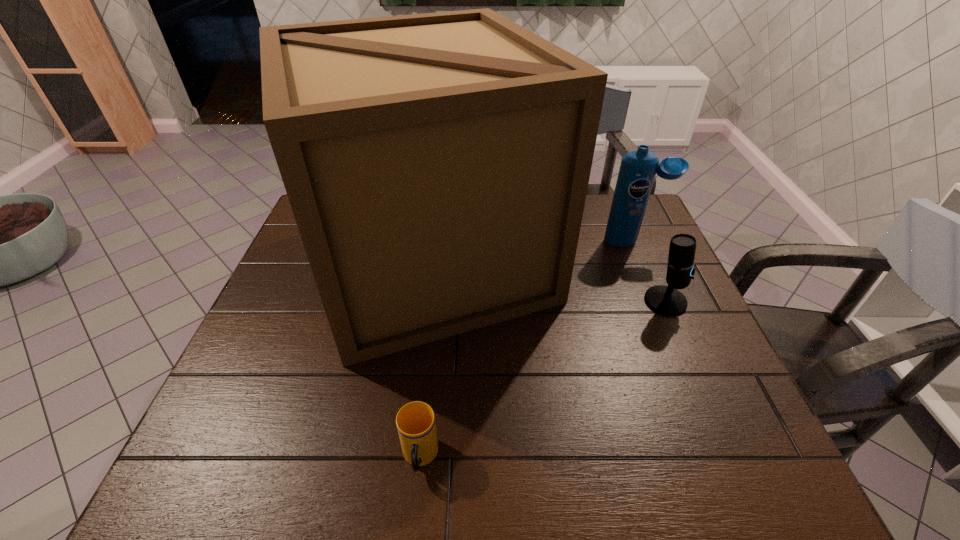
Find the location of `empty space that is in between the shortest object and the second tallest object`. empty space that is in between the shortest object and the second tallest object is located at coordinates (526, 349).

Locate an element on the screen. The image size is (960, 540). vacant space in between the cup and the second tallest object is located at coordinates (526, 349).

Locate an element on the screen. The image size is (960, 540). empty space that is in between the nearest object and the shampoo is located at coordinates (526, 349).

The height and width of the screenshot is (540, 960). In order to click on free point between the box and the nearest object in this screenshot , I will do tap(425, 360).

Locate an element on the screen. The width and height of the screenshot is (960, 540). free space that is in between the microphone and the shortest object is located at coordinates (542, 379).

Where is `unoccupied position between the microphone and the shampoo`? This screenshot has width=960, height=540. unoccupied position between the microphone and the shampoo is located at coordinates (649, 271).

Identify the location of vacant space in between the third shortest object and the microphone. (649, 271).

What are the coordinates of `free space between the microphone and the shampoo` in the screenshot? It's located at (649, 271).

Identify which object is located as the third nearest to the box. Please provide its 2D coordinates. Your answer should be formatted as a tuple, i.e. [(x, y)], where the tuple contains the x and y coordinates of a point satisfying the conditions above.

[(667, 300)]

Identify which object is the third closest to the cup. Please provide its 2D coordinates. Your answer should be formatted as a tuple, i.e. [(x, y)], where the tuple contains the x and y coordinates of a point satisfying the conditions above.

[(637, 171)]